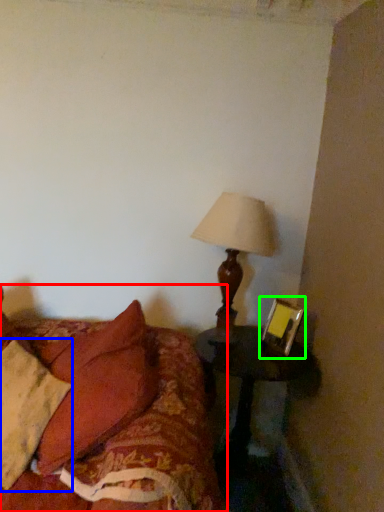
Question: Based on their relative distances, which object is farther from furniture (highlighted by a red box)? Choose from pillow (highlighted by a blue box) and picture frame (highlighted by a green box).

Choices:
 (A) pillow
 (B) picture frame

Answer: (B)